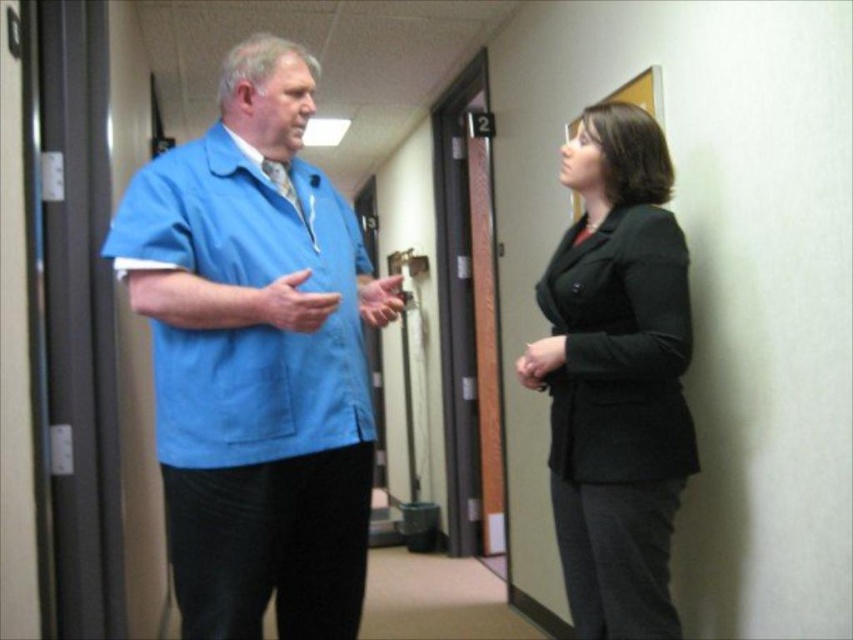
Question: Which point is closer to the camera?

Choices:
 (A) blue fabric shirt at center
 (B) black matte blazer at right

Answer: (A)

Question: Does blue fabric shirt at center have a larger size compared to black matte blazer at right?

Choices:
 (A) no
 (B) yes

Answer: (B)

Question: Can you confirm if blue fabric shirt at center is positioned to the right of black matte blazer at right?

Choices:
 (A) no
 (B) yes

Answer: (A)

Question: Does blue fabric shirt at center appear over black matte blazer at right?

Choices:
 (A) no
 (B) yes

Answer: (B)